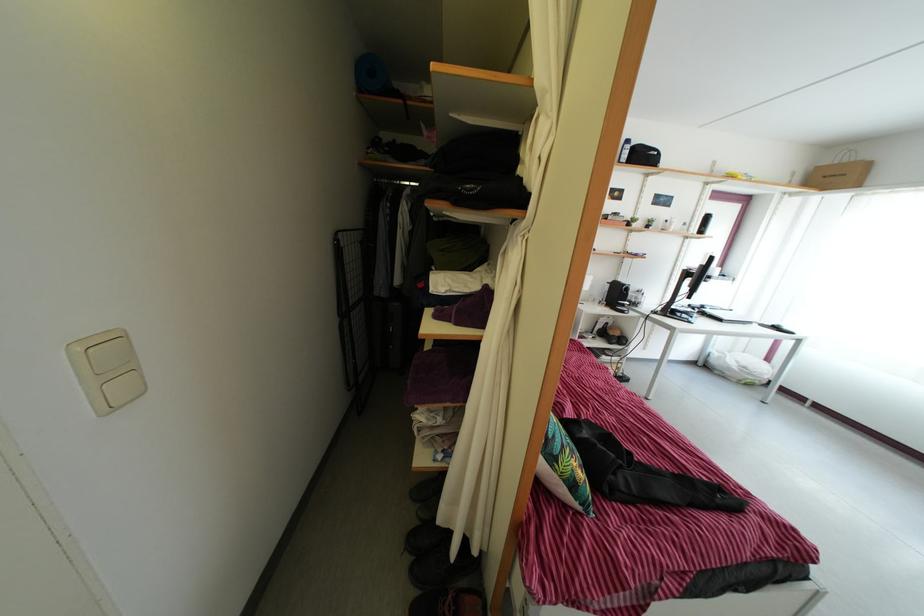
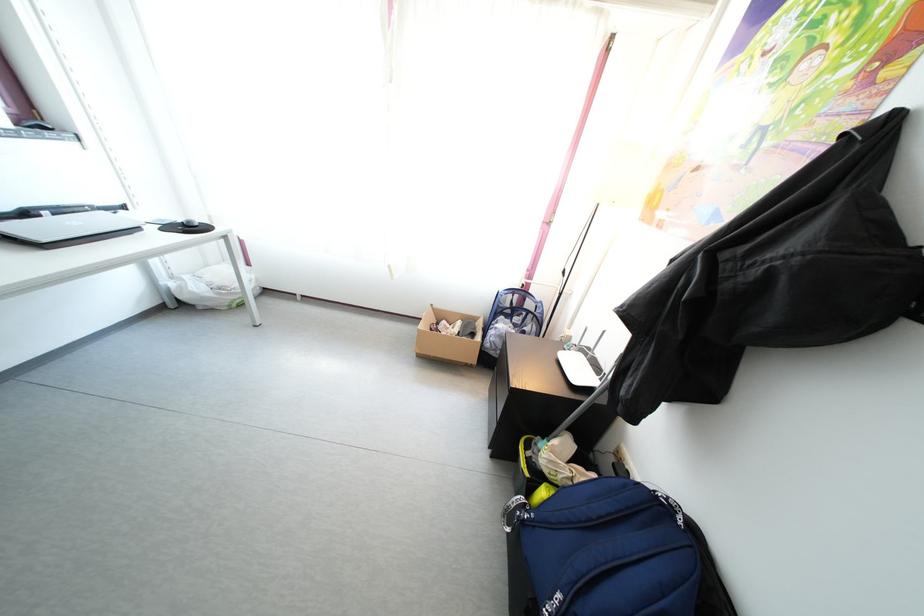
The point at (736, 377) is marked in the first image. Where is the corresponding point in the second image?

(210, 306)